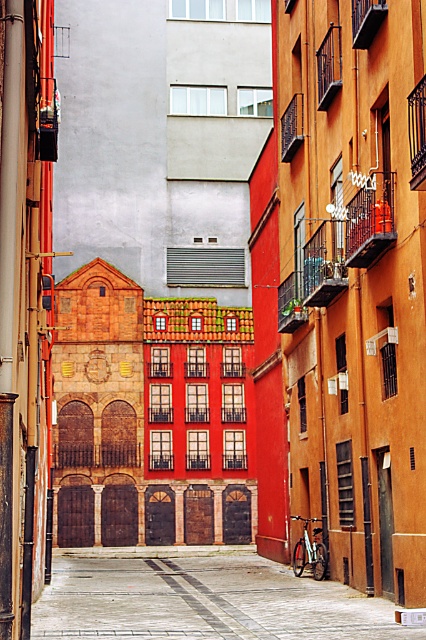
Question: Among these points, which one is farthest from the camera?

Choices:
 (A) (83, 573)
 (B) (307, 554)

Answer: (A)

Question: Does smooth concrete pavement at center appear under silver metallic bicycle at center?

Choices:
 (A) yes
 (B) no

Answer: (A)

Question: Among these points, which one is nearest to the camera?

Choices:
 (A) (311, 554)
 (B) (97, 589)

Answer: (B)

Question: Does smooth concrete pavement at center appear on the left side of silver metallic bicycle at center?

Choices:
 (A) yes
 (B) no

Answer: (A)

Question: Is smooth concrete pavement at center behind silver metallic bicycle at center?

Choices:
 (A) no
 (B) yes

Answer: (A)